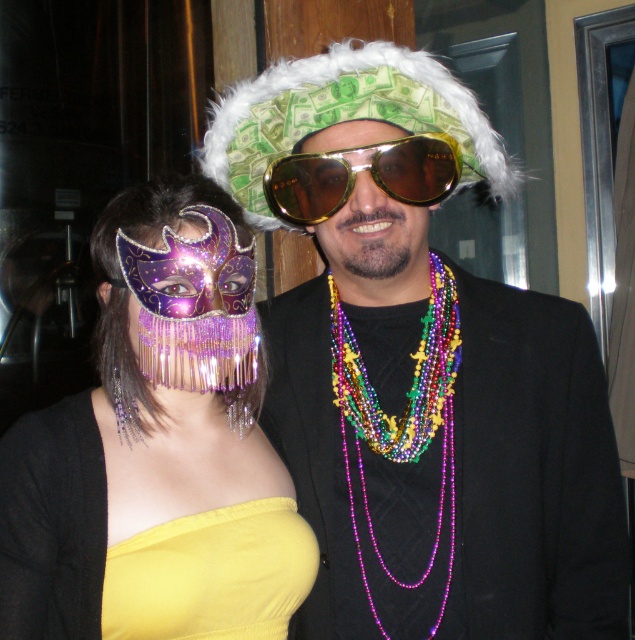
Can you confirm if metallic purple mask at center is positioned to the right of yellow satin dress at lower left?

In fact, metallic purple mask at center is to the left of yellow satin dress at lower left.

Describe the element at coordinates (154, 458) in the screenshot. Image resolution: width=635 pixels, height=640 pixels. I see `metallic purple mask at center` at that location.

Where is `metallic purple mask at center`? The image size is (635, 640). metallic purple mask at center is located at coordinates (154, 458).

Is shiny gold sunglasses at center thinner than yellow satin dress at lower left?

No.

Is point (351, 344) farther from camera compared to point (237, 612)?

Yes, point (351, 344) is farther from viewer.

Between point (612, 444) and point (105, 634), which one is positioned behind?

Positioned behind is point (612, 444).

You are a GUI agent. You are given a task and a screenshot of the screen. Output one action in this format:
    pyautogui.click(x=<x>, y=<y>)
    Task: Click on the shiny gold sunglasses at center
    Image resolution: width=635 pixels, height=640 pixels.
    Given the screenshot: What is the action you would take?
    pyautogui.click(x=420, y=365)

Who is more distant from viewer, (276,572) or (328,189)?

The point (328,189) is behind.

Between point (206, 538) and point (277, 198), which one is positioned behind?

The point (277, 198) is more distant.

In order to click on yellow satin dress at lower left in this screenshot , I will do `click(211, 573)`.